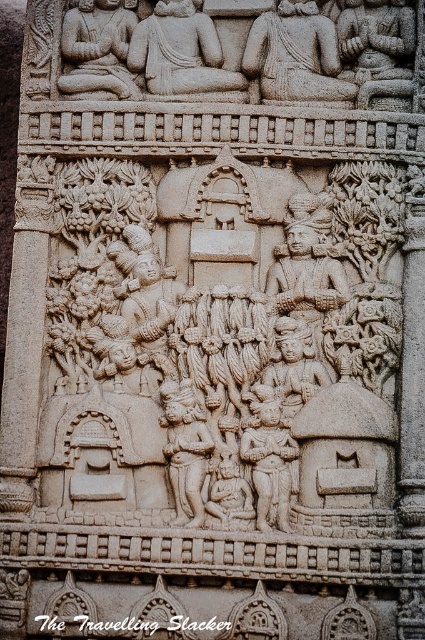
Is smooth stone figure at upper center below carved stone figure at center?

No, smooth stone figure at upper center is not below carved stone figure at center.

Can you confirm if smooth stone figure at upper center is positioned above carved stone figure at center?

Yes, smooth stone figure at upper center is above carved stone figure at center.

Find the location of `smooth stone figure at upper center`. smooth stone figure at upper center is located at coordinates (98, 49).

Does carved stone figures at center have a greater width compared to stone statue at upper center?

Indeed, carved stone figures at center has a greater width compared to stone statue at upper center.

Which is above, carved stone figures at center or stone statue at upper center?

stone statue at upper center is above.

The image size is (425, 640). In order to click on carved stone figures at center in this screenshot , I will do `click(224, 342)`.

Who is higher up, stone statue at upper center or carved stone figure at center?

Positioned higher is stone statue at upper center.

You are a GUI agent. You are given a task and a screenshot of the screen. Output one action in this format:
    pyautogui.click(x=<x>, y=<y>)
    Task: Click on the stone statue at upper center
    This screenshot has height=640, width=425.
    Given the screenshot: What is the action you would take?
    pyautogui.click(x=180, y=51)

This screenshot has width=425, height=640. In order to click on stone statue at upper center in this screenshot , I will do `click(180, 51)`.